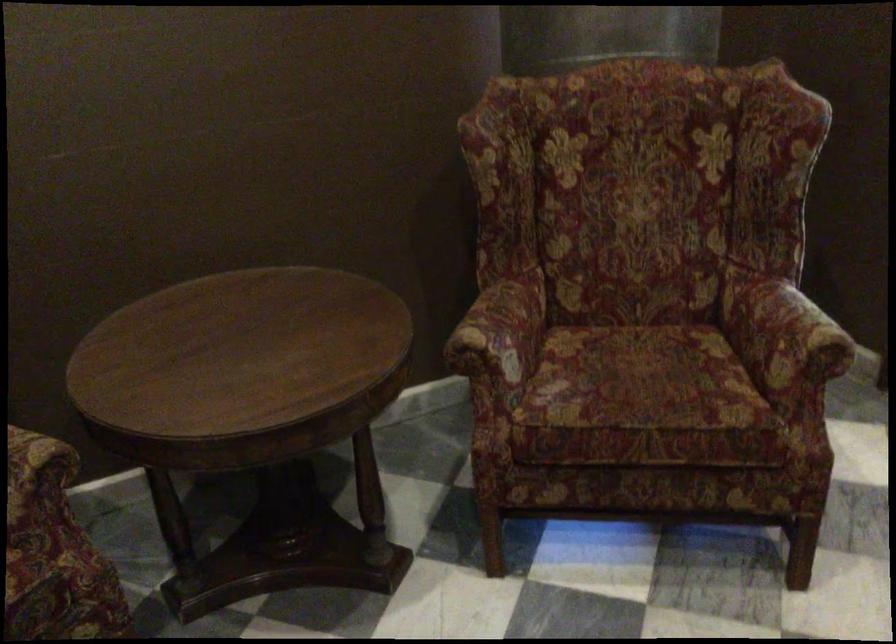
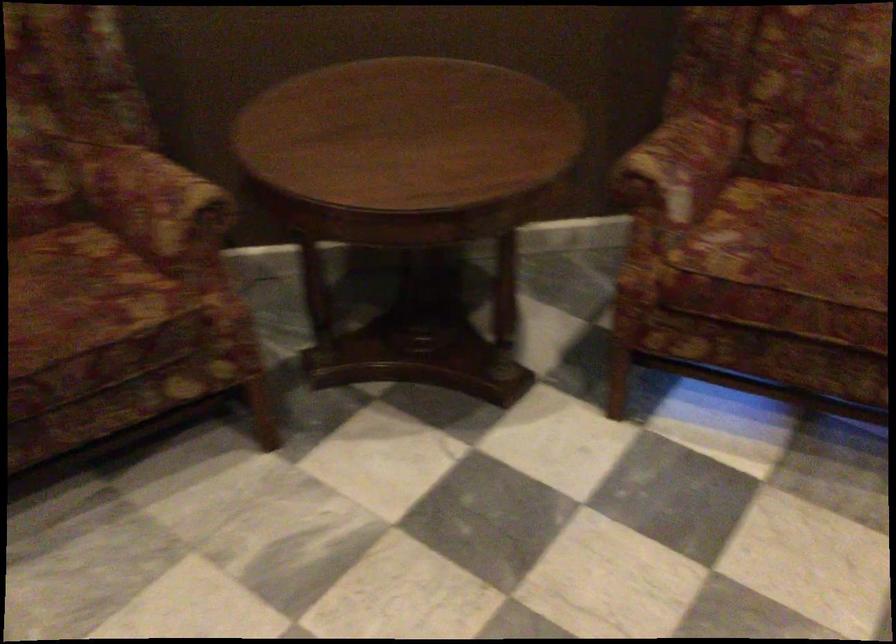
The point at (504, 328) is marked in the first image. Where is the corresponding point in the second image?

(679, 164)